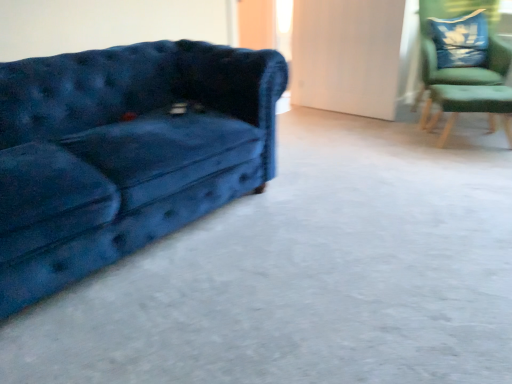
Question: Does point (453, 122) appear closer or farther from the camera than point (157, 256)?

Choices:
 (A) closer
 (B) farther

Answer: (B)

Question: Considering the positions of green fabric side table at right and blue velvet couch at left in the image, is green fabric side table at right taller or shorter than blue velvet couch at left?

Choices:
 (A) short
 (B) tall

Answer: (B)

Question: Which object is the closest to the velvet blue pillow at upper right?

Choices:
 (A) green fabric side table at right
 (B) blue velvet couch at left
 (C) velvet blue couch at left
 (D) green fabric chair at upper right

Answer: (D)

Question: Estimate the real-world distances between objects in this image. Which object is closer to the velvet blue couch at left?

Choices:
 (A) blue velvet couch at left
 (B) green fabric side table at right
 (C) velvet blue pillow at upper right
 (D) green fabric chair at upper right

Answer: (A)